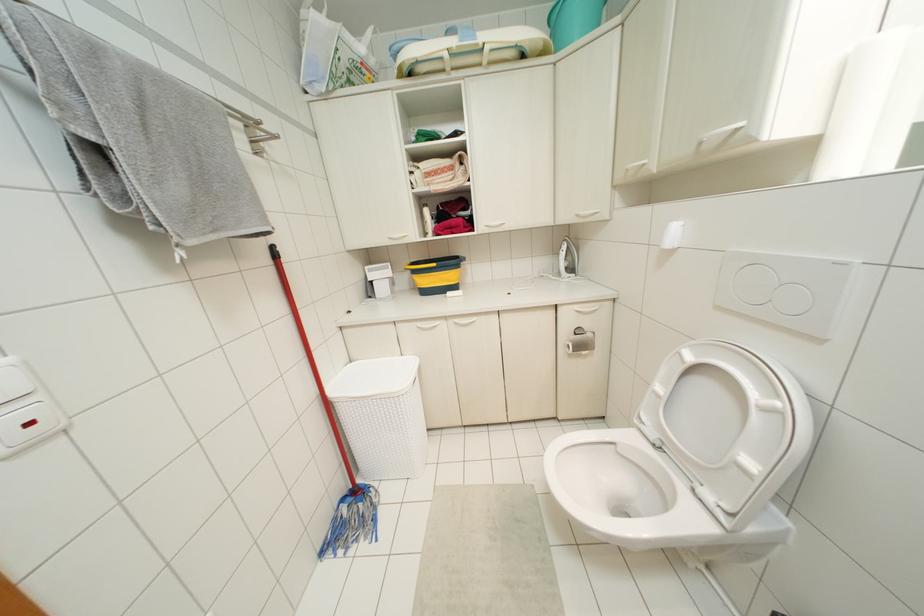
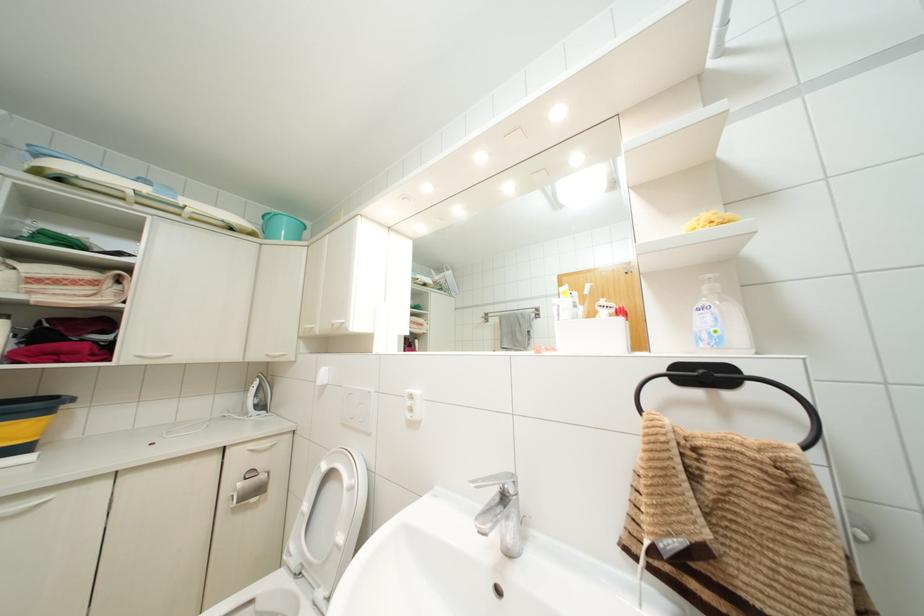
Based on the continuous images, in which direction is the camera rotating?

The rotation direction of the camera is right-up.